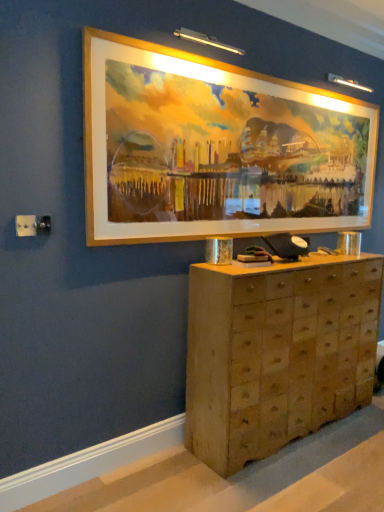
Question: Looking at their shapes, would you say wooden chest of drawers at center is wider or thinner than gold-framed painting at upper center?

Choices:
 (A) thin
 (B) wide

Answer: (B)

Question: From their relative heights in the image, would you say wooden chest of drawers at center is taller or shorter than gold-framed painting at upper center?

Choices:
 (A) tall
 (B) short

Answer: (A)

Question: Considering the relative positions of wooden chest of drawers at center and gold-framed painting at upper center in the image provided, is wooden chest of drawers at center to the left or to the right of gold-framed painting at upper center?

Choices:
 (A) left
 (B) right

Answer: (B)

Question: Is gold-framed painting at upper center spatially inside wooden chest of drawers at center, or outside of it?

Choices:
 (A) inside
 (B) outside

Answer: (B)

Question: From the image's perspective, relative to wooden chest of drawers at center, is gold-framed painting at upper center above or below?

Choices:
 (A) above
 (B) below

Answer: (A)

Question: Considering the relative positions of gold-framed painting at upper center and wooden chest of drawers at center in the image provided, is gold-framed painting at upper center to the left or to the right of wooden chest of drawers at center?

Choices:
 (A) left
 (B) right

Answer: (A)

Question: In terms of size, does gold-framed painting at upper center appear bigger or smaller than wooden chest of drawers at center?

Choices:
 (A) small
 (B) big

Answer: (A)